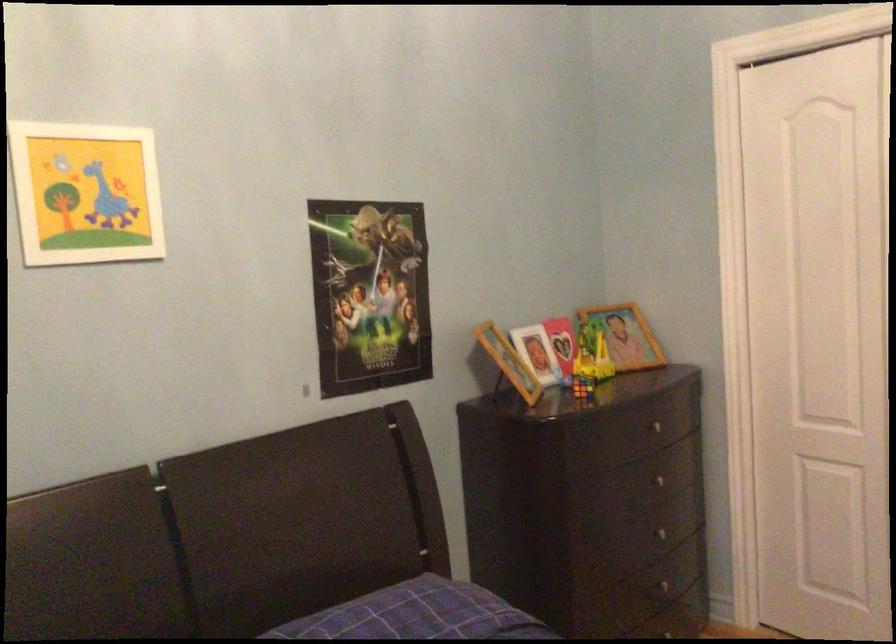
Which object does [369,294] point to?

This point indicates the leaning picture frame.